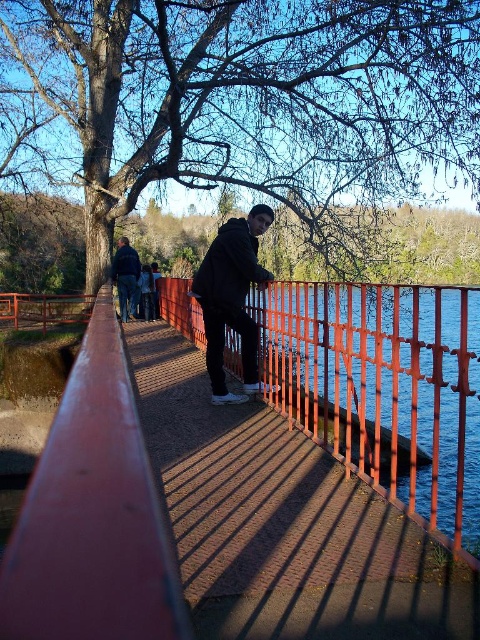
You are standing on the bridge and want to take a photo of the dark blue jeans at left and the brick pavement at center. Which object should you focus on first if you want to capture both in the same frame?

Since the brick pavement at center is to the right of the dark blue jeans at left, you should focus on the dark blue jeans at left first to ensure both are in the frame.